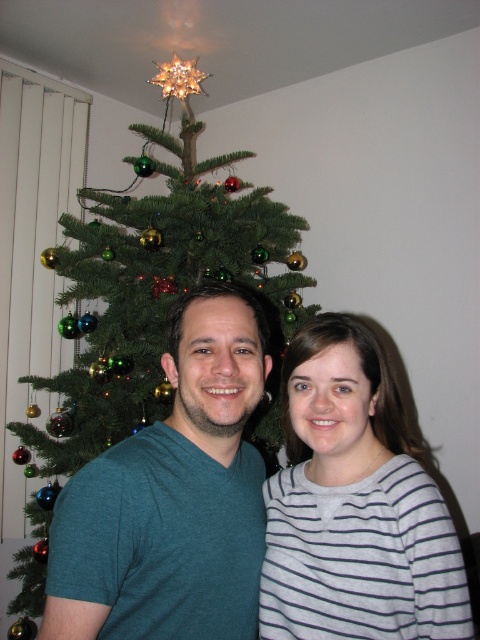
Question: Which point is closer to the camera?

Choices:
 (A) (165, 385)
 (B) (240, 384)
 (C) (430, 509)

Answer: (B)

Question: Does teal matte t-shirt at center appear on the left side of gray striped shirt at center?

Choices:
 (A) yes
 (B) no

Answer: (A)

Question: Can you confirm if teal matte t-shirt at center is wider than gray striped shirt at center?

Choices:
 (A) no
 (B) yes

Answer: (B)

Question: Which of the following is the farthest from the observer?

Choices:
 (A) (169, 227)
 (B) (228, 422)

Answer: (A)

Question: Considering the real-world distances, which object is farthest from the green matte christmas tree at center?

Choices:
 (A) gray striped shirt at center
 (B) teal matte t-shirt at center

Answer: (B)

Question: Is teal matte t-shirt at center positioned at the back of gray striped shirt at center?

Choices:
 (A) yes
 (B) no

Answer: (B)